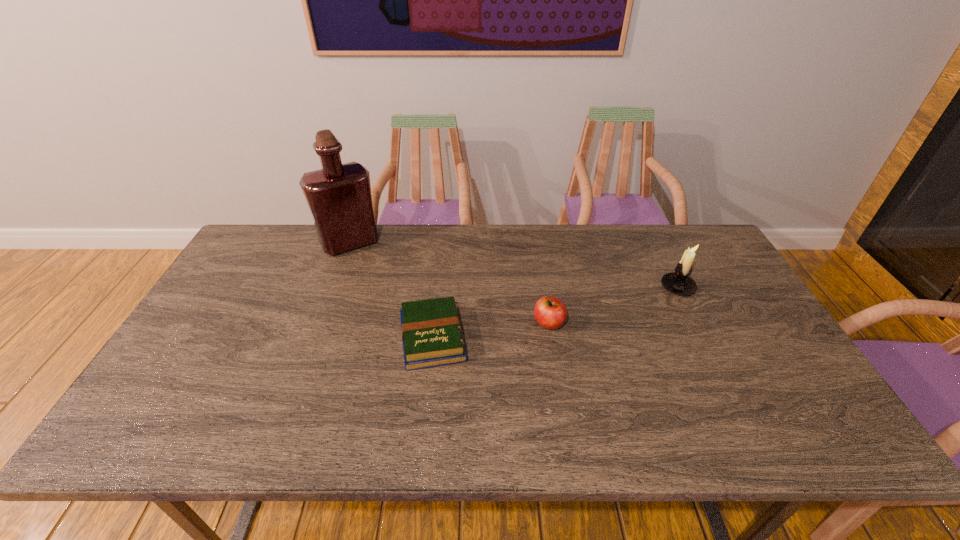
Locate an element on the screen. This screenshot has width=960, height=540. vacant region between the liquor and the apple is located at coordinates (449, 283).

In order to click on free space between the second object from right to left and the liquor in this screenshot , I will do `click(449, 283)`.

You are a GUI agent. You are given a task and a screenshot of the screen. Output one action in this format:
    pyautogui.click(x=<x>, y=<y>)
    Task: Click on the free space between the third object from right to left and the leftmost object
    The width and height of the screenshot is (960, 540).
    Given the screenshot: What is the action you would take?
    pyautogui.click(x=392, y=290)

Identify which object is the third closest to the second object from left to right. Please provide its 2D coordinates. Your answer should be formatted as a tuple, i.e. [(x, y)], where the tuple contains the x and y coordinates of a point satisfying the conditions above.

[(678, 282)]

Identify which object is located as the third nearest to the shortest object. Please provide its 2D coordinates. Your answer should be formatted as a tuple, i.e. [(x, y)], where the tuple contains the x and y coordinates of a point satisfying the conditions above.

[(678, 282)]

Where is `vacant area that satisfies the following two spatial constraints: 1. on the back side of the second object from right to left; 2. on the right side of the second object from left to right`? The width and height of the screenshot is (960, 540). vacant area that satisfies the following two spatial constraints: 1. on the back side of the second object from right to left; 2. on the right side of the second object from left to right is located at coordinates (434, 323).